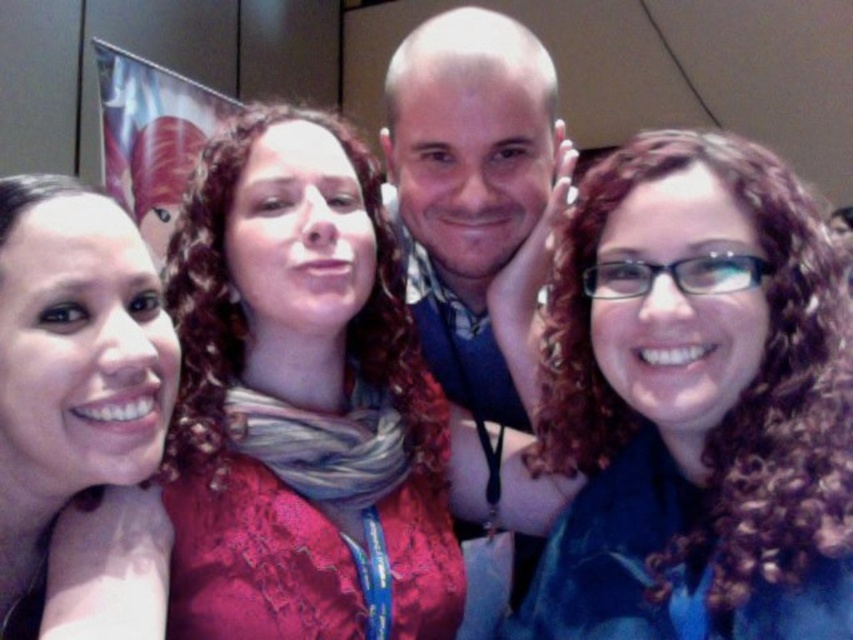
Between point (412, 445) and point (4, 456), which one is positioned in front?

Point (4, 456) is more forward.

The height and width of the screenshot is (640, 853). Find the location of `matte red lace dress at center`. matte red lace dress at center is located at coordinates (306, 406).

Does point (155, 396) come in front of point (404, 140)?

That is True.

This screenshot has width=853, height=640. I want to click on matte pink scarf at left, so click(x=71, y=369).

Which of these two, matte blue scarf at center or matte pink scarf at left, stands shorter?

matte pink scarf at left

Does matte blue scarf at center appear under matte pink scarf at left?

Correct, matte blue scarf at center is located below matte pink scarf at left.

What are the coordinates of `matte blue scarf at center` in the screenshot? It's located at (695, 403).